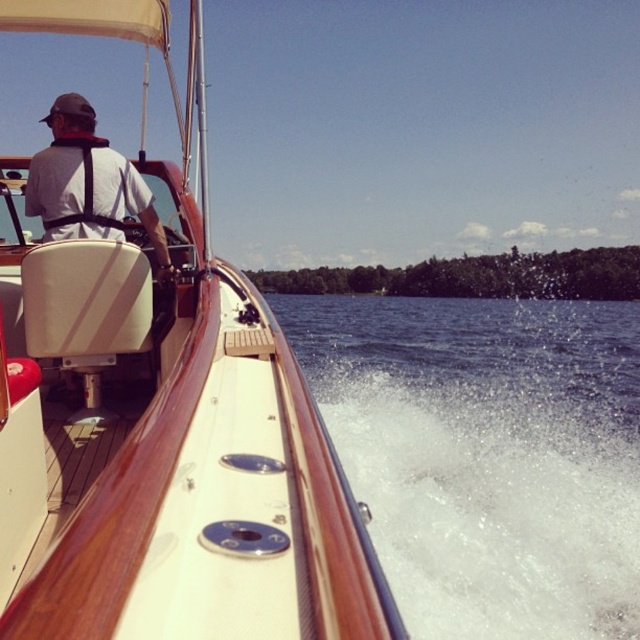
You are an observer standing on the dock watching the wooden polished boat at center and the white frothy water at lower right. Which object is wider in terms of their widths?

The white frothy water at lower right is wider than the wooden polished boat at center.

You are navigating a boat and want to avoid hitting an obstacle. The boat is moving forward, and you notice the white frothy water at lower right. Based on its position, which direction should you turn to avoid it?

The white frothy water at lower right is located at point 0.711 on the x axis and 0.762 on the y axis. Since it is positioned at the lower right, you should turn the boat to the left to avoid hitting the obstacle.